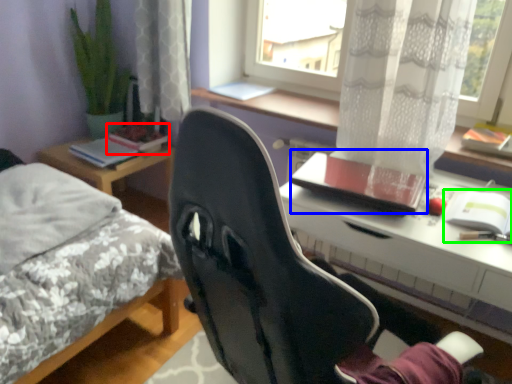
Question: Estimate the real-world distances between objects in this image. Which object is closer to book (highlighted by a red box), notebook (highlighted by a blue box) or notebook (highlighted by a green box)?

Choices:
 (A) notebook
 (B) notebook

Answer: (A)